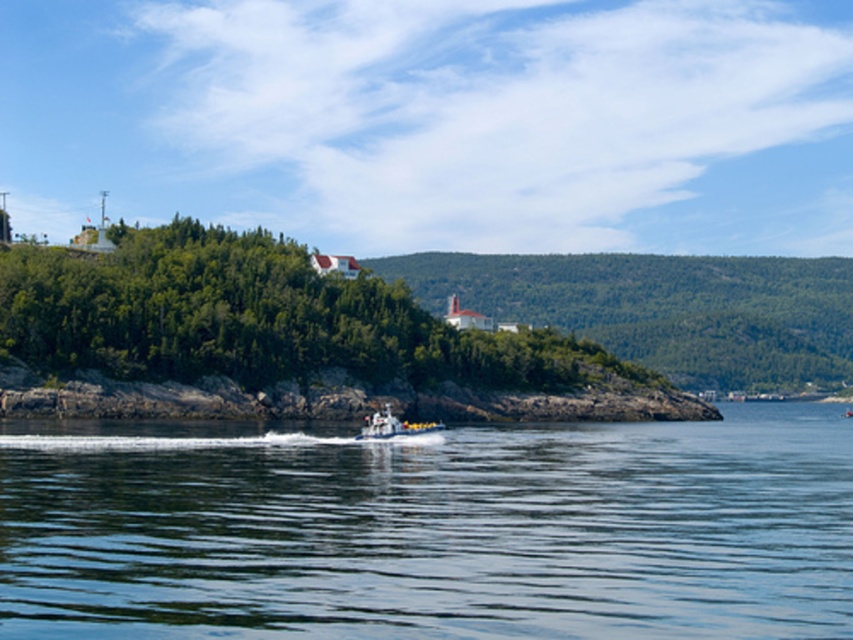
You are standing on the rocky shoreline and see the clear blue water at center and the metallic gray boat at center. Which object is closer to the ground level?

The clear blue water at center is closer to the ground level because it is below the metallic gray boat at center.

You are standing on the rocky shoreline and see the clear blue water at center and the metallic gray boat at center. Which object is positioned to the right of the other?

The clear blue water at center is to the right of the metallic gray boat at center.

You are standing at the edge of the rocky shoreline in the coastal scene. You see two points marked in the image. Which point, point (107, 618) or point (396, 429), is closer to you?

Point (107, 618) is closer to the viewer than point (396, 429).